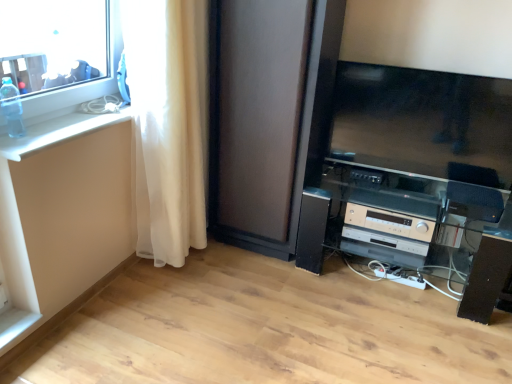
The height and width of the screenshot is (384, 512). I want to click on blank space above beige plastic stereo at lower right (from a real-world perspective), so click(x=405, y=200).